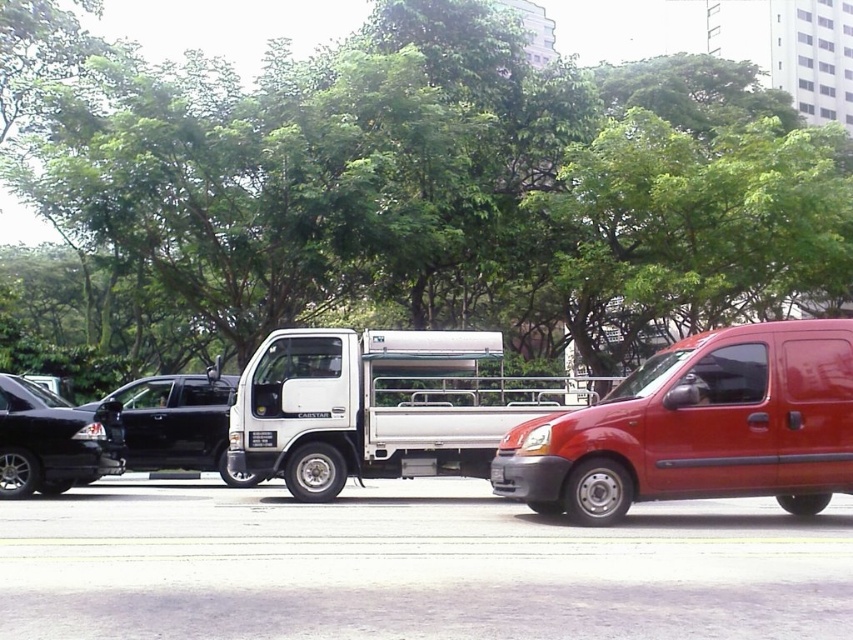
Question: Is glossy red van at center closer to the viewer compared to shiny black sedan at left?

Choices:
 (A) yes
 (B) no

Answer: (A)

Question: Is glossy red van at center closer to camera compared to white matte truck at center?

Choices:
 (A) no
 (B) yes

Answer: (B)

Question: Considering the real-world distances, which object is closest to the green leafy tree at upper center?

Choices:
 (A) white matte truck at center
 (B) shiny black sedan at left
 (C) glossy red van at center

Answer: (B)

Question: Estimate the real-world distances between objects in this image. Which object is closer to the glossy red van at center?

Choices:
 (A) green leafy tree at upper center
 (B) shiny black sedan at left

Answer: (B)

Question: Which of the following is the closest to the observer?

Choices:
 (A) green leafy tree at upper center
 (B) shiny black sedan at left
 (C) white matte truck at center

Answer: (C)

Question: Is green leafy tree at upper center below white matte truck at center?

Choices:
 (A) no
 (B) yes

Answer: (A)